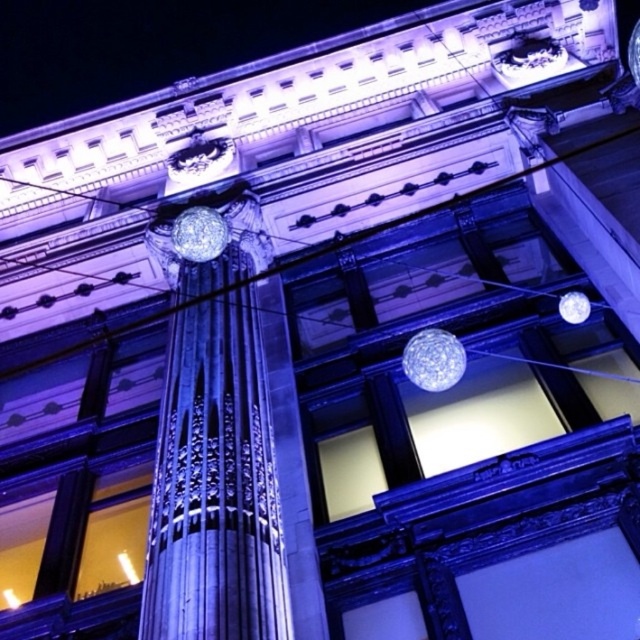
Question: Which point is farther to the camera?

Choices:
 (A) (576, 291)
 (B) (444, 378)
 (C) (262, 250)

Answer: (C)

Question: Does satin silver column at center appear under transparent glass sphere at upper right?

Choices:
 (A) no
 (B) yes

Answer: (A)

Question: Can you confirm if transparent glass sphere at center is positioned above transparent glass sphere at upper right?

Choices:
 (A) yes
 (B) no

Answer: (B)

Question: Which object appears closest to the camera in this image?

Choices:
 (A) transparent glass sphere at center
 (B) transparent glass sphere at upper right
 (C) satin silver column at center

Answer: (C)

Question: Among these points, which one is nearest to the camera?

Choices:
 (A) (428, 336)
 (B) (243, 440)
 (C) (580, 305)

Answer: (A)

Question: Is the position of satin silver column at center less distant than that of transparent glass sphere at center?

Choices:
 (A) yes
 (B) no

Answer: (A)